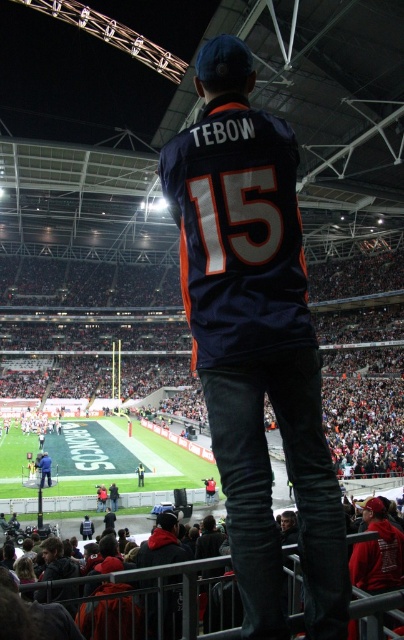
Does navy blue jersey at center have a smaller size compared to blue jersey at center?

Actually, navy blue jersey at center might be larger than blue jersey at center.

Is point (206, 252) less distant than point (44, 461)?

That is True.

Is point (269, 536) closer to viewer compared to point (48, 468)?

Yes.

Where is `navy blue jersey at center`? navy blue jersey at center is located at coordinates (256, 339).

What do you see at coordinates (256, 339) in the screenshot?
I see `navy blue jersey at center` at bounding box center [256, 339].

Is navy blue jersey at center shorter than dark blue jersey at center?

No, navy blue jersey at center is not shorter than dark blue jersey at center.

Which is behind, point (199, 68) or point (151, 608)?

Positioned behind is point (151, 608).

The height and width of the screenshot is (640, 404). I want to click on navy blue jersey at center, so click(256, 339).

Which is in front, point (166, 528) or point (42, 477)?

Point (166, 528) is more forward.

Does dark blue jersey at center appear on the right side of blue jersey at center?

Indeed, dark blue jersey at center is positioned on the right side of blue jersey at center.

Does point (147, 545) lie in front of point (46, 465)?

Yes.

I want to click on dark blue jersey at center, so click(x=162, y=544).